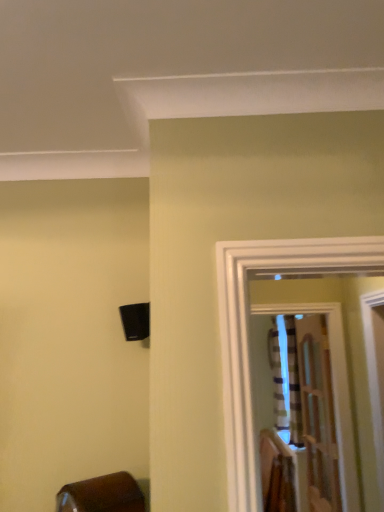
You are a GUI agent. You are given a task and a screenshot of the screen. Output one action in this format:
    pyautogui.click(x=<x>, y=<y>)
    Task: Click on the wooden door at center
    
    Given the screenshot: What is the action you would take?
    pyautogui.click(x=333, y=383)

The width and height of the screenshot is (384, 512). Describe the element at coordinates (333, 383) in the screenshot. I see `wooden door at center` at that location.

In order to face wooden door at center, should I rotate leftwards or rightwards?

Rotate right and turn 13.605 degrees.

I want to click on wooden door at center, so tap(333, 383).